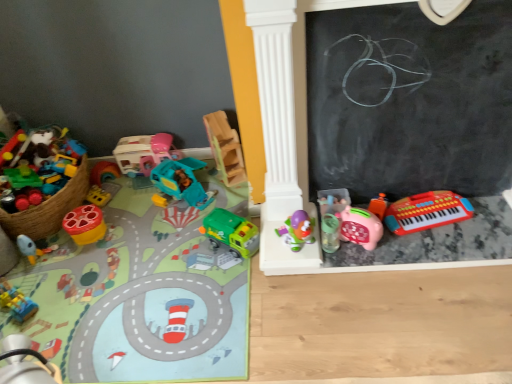
The height and width of the screenshot is (384, 512). I want to click on vacant area that lies between green plastic toy truck at center, the 5th toy from the right, and matte plastic toy rocket at lower left, which is the 12th toy from right to left, so point(142,251).